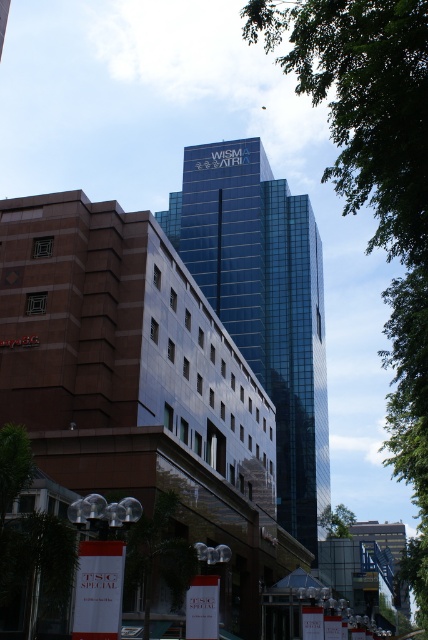
Question: Among these points, which one is farthest from the camera?

Choices:
 (A) (262, 205)
 (B) (404, 442)

Answer: (A)

Question: From the image, what is the correct spatial relationship of green leafy tree at upper right in relation to shiny glass tower at center?

Choices:
 (A) below
 (B) above

Answer: (B)

Question: Is green leafy tree at upper right below shiny glass tower at center?

Choices:
 (A) no
 (B) yes

Answer: (A)

Question: Which of the following is the closest to the observer?

Choices:
 (A) green leafy tree at center
 (B) shiny glass tower at center
 (C) green leafy tree at lower center

Answer: (C)

Question: Is green leafy tree at lower center positioned behind green leafy tree at center?

Choices:
 (A) yes
 (B) no

Answer: (B)

Question: Which point appears closest to the camera in this image?

Choices:
 (A) (321, 58)
 (B) (165, 493)

Answer: (A)